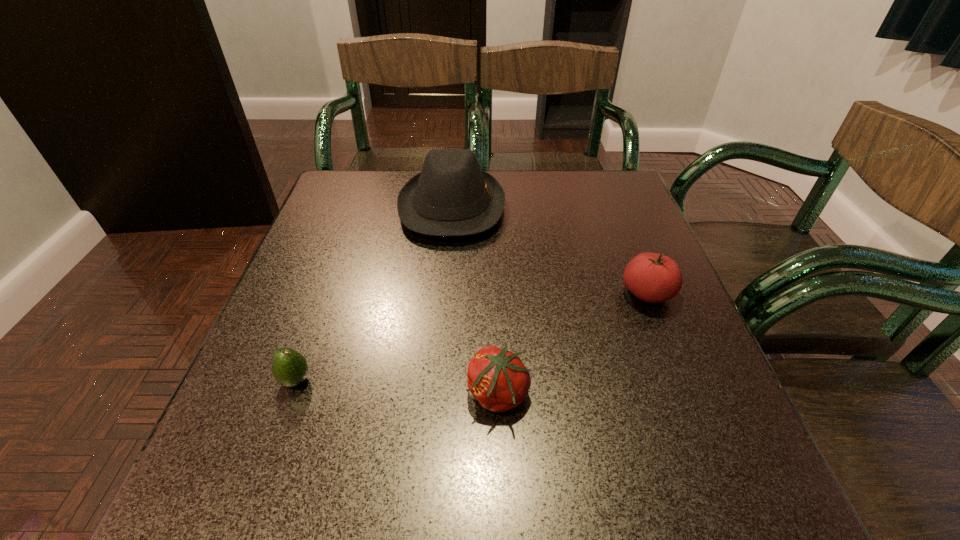
Find the location of a particular element. The height and width of the screenshot is (540, 960). vacant space that's between the nearer tomato and the leftmost object is located at coordinates (396, 387).

The width and height of the screenshot is (960, 540). In order to click on the second closest object relative to the right tomato in this screenshot , I will do `click(451, 196)`.

The image size is (960, 540). In order to click on object that is the third closest to the avocado in this screenshot , I will do `click(651, 277)`.

You are a GUI agent. You are given a task and a screenshot of the screen. Output one action in this format:
    pyautogui.click(x=<x>, y=<y>)
    Task: Click on the free space in the image that satisfies the following two spatial constraints: 1. on the front-facing side of the farthest object; 2. on the front side of the avocado
    The image size is (960, 540).
    Given the screenshot: What is the action you would take?
    pyautogui.click(x=438, y=380)

The image size is (960, 540). Find the location of `vacant space that satisfies the following two spatial constraints: 1. on the front-facing side of the fedora; 2. on the right side of the taller tomato`. vacant space that satisfies the following two spatial constraints: 1. on the front-facing side of the fedora; 2. on the right side of the taller tomato is located at coordinates (444, 293).

The height and width of the screenshot is (540, 960). I want to click on vacant space that satisfies the following two spatial constraints: 1. on the front-facing side of the second farthest object; 2. on the right side of the tallest object, so click(x=444, y=293).